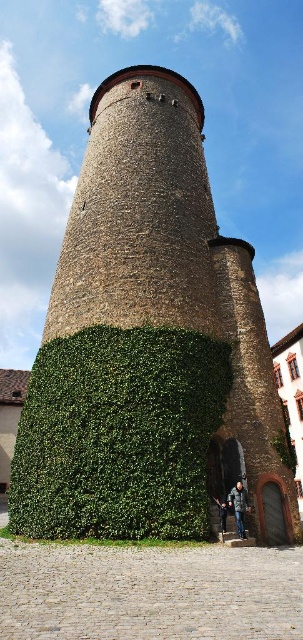
Question: Which point is closer to the camera taking this photo?

Choices:
 (A) (33, 451)
 (B) (139, 435)

Answer: (B)

Question: Which point is farther to the camera?

Choices:
 (A) (167, 472)
 (B) (117, 333)

Answer: (B)

Question: Among these points, which one is farthest from the camera?

Choices:
 (A) (x=47, y=493)
 (B) (x=26, y=531)

Answer: (B)

Question: Is green ivy-covered tower at center positioned behind green leafy hedge at center?

Choices:
 (A) yes
 (B) no

Answer: (A)

Question: Is green ivy-covered tower at center further to camera compared to green leafy hedge at center?

Choices:
 (A) no
 (B) yes

Answer: (B)

Question: Is green ivy-covered tower at center closer to the viewer compared to green leafy hedge at center?

Choices:
 (A) yes
 (B) no

Answer: (B)